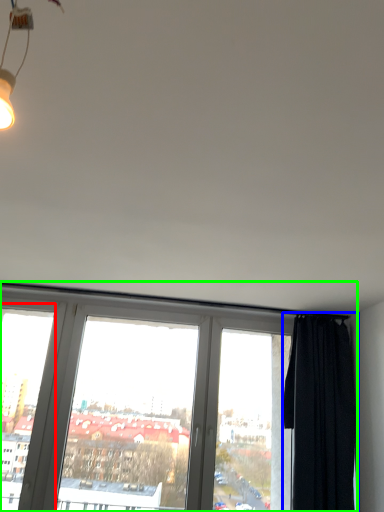
Question: Based on their relative distances, which object is farther from window frame (highlighted by a red box)? Choose from curtain (highlighted by a blue box) and window (highlighted by a green box).

Choices:
 (A) curtain
 (B) window

Answer: (A)